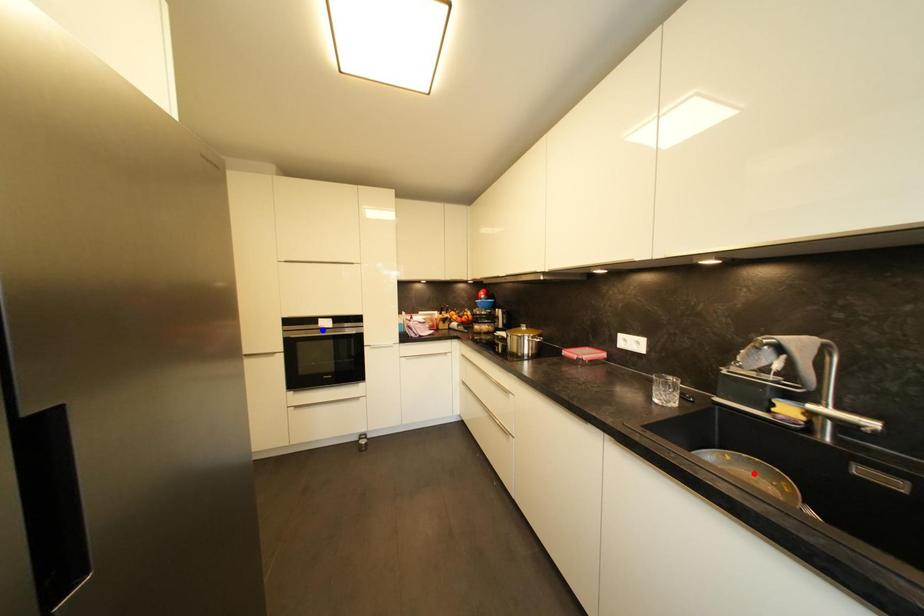
Question: In the image, two points are highlighted. Which point is nearer to the camera? Reply with the corresponding letter.

Choices:
 (A) blue point
 (B) red point

Answer: (B)